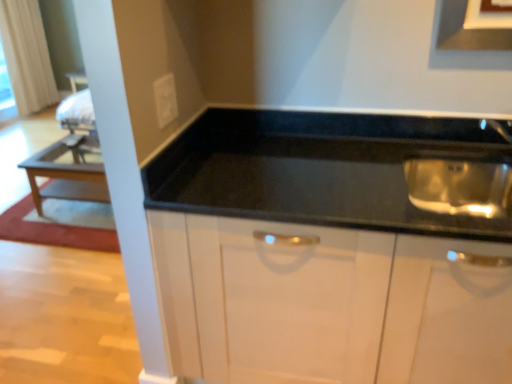
Question: Does white fabric curtain at upper left have a lesser width compared to matte black exhaust hood at upper center?

Choices:
 (A) no
 (B) yes

Answer: (A)

Question: Does white fabric curtain at upper left have a lesser height compared to matte black exhaust hood at upper center?

Choices:
 (A) yes
 (B) no

Answer: (B)

Question: Is there a large distance between white fabric curtain at upper left and matte black exhaust hood at upper center?

Choices:
 (A) no
 (B) yes

Answer: (B)

Question: Is matte black exhaust hood at upper center at the back of white fabric curtain at upper left?

Choices:
 (A) no
 (B) yes

Answer: (A)

Question: Considering the relative sizes of white fabric curtain at upper left and matte black exhaust hood at upper center in the image provided, is white fabric curtain at upper left bigger than matte black exhaust hood at upper center?

Choices:
 (A) yes
 (B) no

Answer: (A)

Question: Does white fabric curtain at upper left have a greater width compared to matte black exhaust hood at upper center?

Choices:
 (A) no
 (B) yes

Answer: (B)

Question: From a real-world perspective, is black glossy cabinet at center on top of matte black exhaust hood at upper center?

Choices:
 (A) no
 (B) yes

Answer: (A)

Question: Would you say black glossy cabinet at center is outside matte black exhaust hood at upper center?

Choices:
 (A) yes
 (B) no

Answer: (A)

Question: Is black glossy cabinet at center at the right side of matte black exhaust hood at upper center?

Choices:
 (A) yes
 (B) no

Answer: (B)

Question: Considering the relative sizes of black glossy cabinet at center and matte black exhaust hood at upper center in the image provided, is black glossy cabinet at center smaller than matte black exhaust hood at upper center?

Choices:
 (A) no
 (B) yes

Answer: (A)

Question: Considering the relative sizes of black glossy cabinet at center and matte black exhaust hood at upper center in the image provided, is black glossy cabinet at center bigger than matte black exhaust hood at upper center?

Choices:
 (A) yes
 (B) no

Answer: (A)

Question: Is black glossy cabinet at center positioned with its back to matte black exhaust hood at upper center?

Choices:
 (A) yes
 (B) no

Answer: (B)

Question: Is matte black exhaust hood at upper center at the right side of wooden table at left?

Choices:
 (A) yes
 (B) no

Answer: (A)